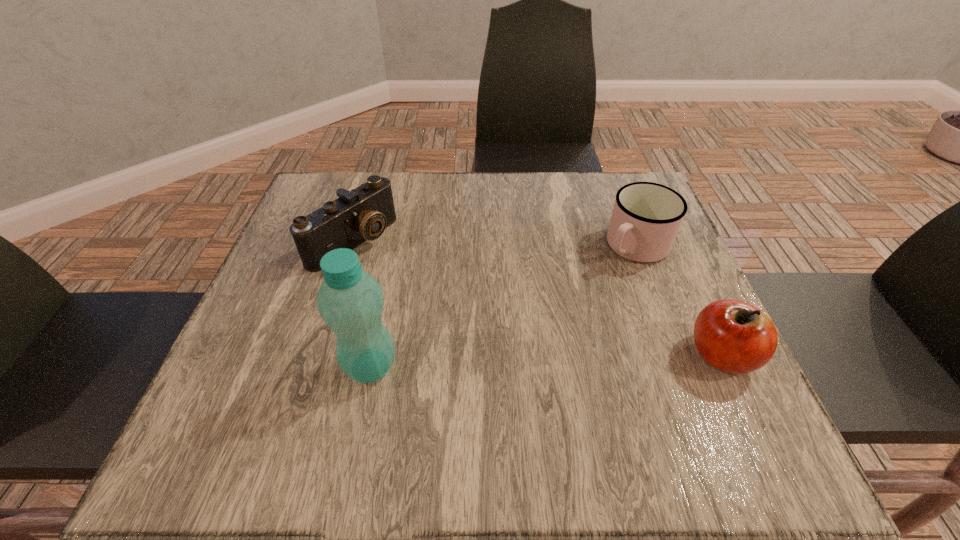
This screenshot has width=960, height=540. In order to click on object located at the far right corner in this screenshot , I will do `click(646, 217)`.

The image size is (960, 540). I want to click on object that is at the near right corner, so click(x=733, y=336).

This screenshot has width=960, height=540. Find the location of `vacant region at the far edge of the desktop`. vacant region at the far edge of the desktop is located at coordinates (524, 222).

Where is `vacant region at the near edge of the desktop`? vacant region at the near edge of the desktop is located at coordinates (526, 410).

In the image, there is a desktop. At what (x,y) coordinates should I click in order to perform the action: click on vacant space at the left edge. Please return your answer as a coordinate pair (x, y). The height and width of the screenshot is (540, 960). Looking at the image, I should click on (270, 309).

This screenshot has height=540, width=960. In the image, there is a desktop. Find the location of `vacant space at the right edge`. vacant space at the right edge is located at coordinates (614, 262).

Where is `vacant space at the far left corner of the desktop`? This screenshot has width=960, height=540. vacant space at the far left corner of the desktop is located at coordinates (373, 172).

The width and height of the screenshot is (960, 540). I want to click on free spot at the near left corner of the desktop, so click(217, 382).

The image size is (960, 540). In order to click on empty space between the apple and the mug in this screenshot , I will do `click(679, 300)`.

Identify the location of free space between the camera and the apple. (537, 299).